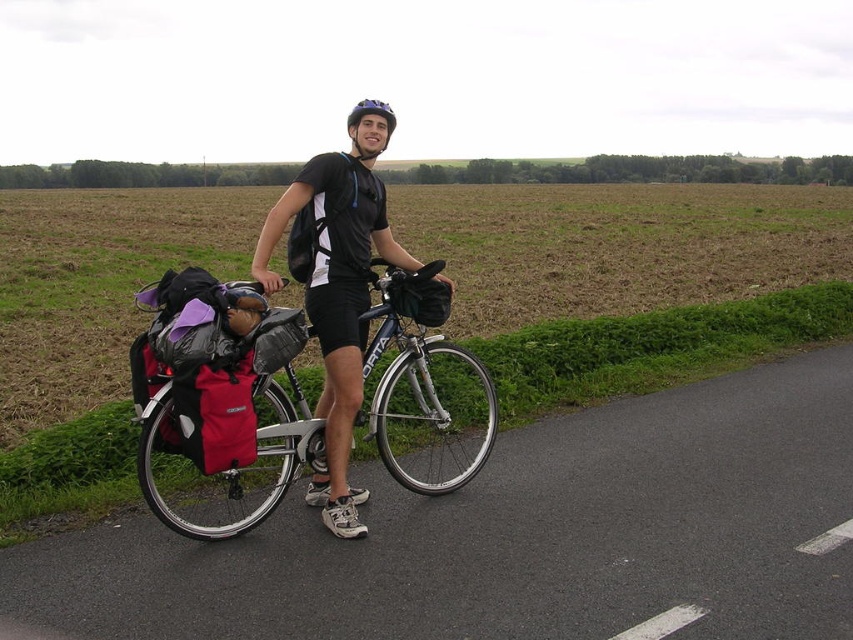
You are a delivery person who needs to secure a package on your matte black bicycle at center. You have a strap that can only fit around objects larger than the black matte shirt at center. Will the strap work for securing the package?

The matte black bicycle at center is larger in size than the black matte shirt at center, so the strap that can fit around objects larger than the black matte shirt at center will work for securing the package on the matte black bicycle at center.

Looking at this image, you are a photographer taking a picture of the black matte shirt at center and the purple matte bicycle helmet at center. Which object should be positioned lower in the frame to ensure both are visible?

The black matte shirt at center should be positioned lower in the frame because it is shorter than the purple matte bicycle helmet at center, allowing both to fit within the frame.

You are a delivery drone operator and need to deliver a package to a location marked at coordinates 0.7, 0.25. The matte black bicycle at center is in your path. Can you safely navigate around it without deviating from your delivery route?

The matte black bicycle at center is located at point (219, 420), which is very close to the delivery coordinates (212, 448). The drone should be able to navigate around it safely by adjusting its path slightly, as long as there is enough clearance between the bicycle and the intended route.